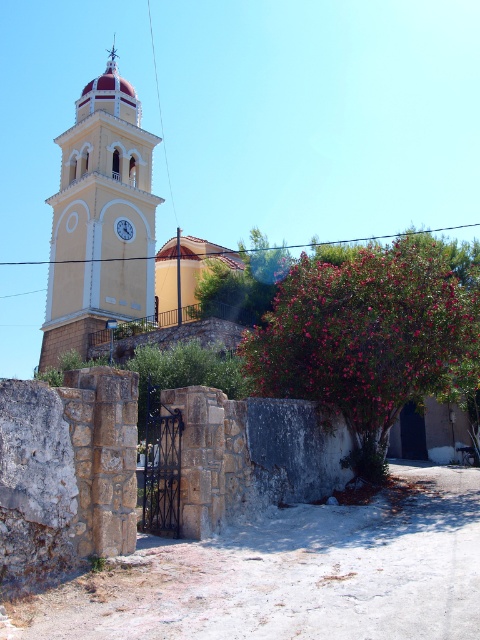
You are a tourist standing in front of the matte yellow clock tower at center and the white glossy clock at upper center. Which clock is positioned higher in the image?

The matte yellow clock tower at center is positioned higher than the white glossy clock at upper center.